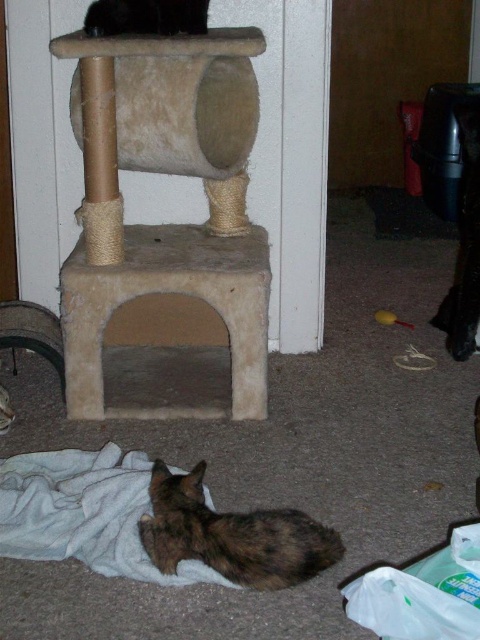
Does brown fur cat at lower center have a lesser width compared to black fur cat at upper center?

In fact, brown fur cat at lower center might be wider than black fur cat at upper center.

Does point (222, 554) come farther from viewer compared to point (195, 4)?

That is False.

This screenshot has width=480, height=640. What are the coordinates of `brown fur cat at lower center` in the screenshot? It's located at (231, 536).